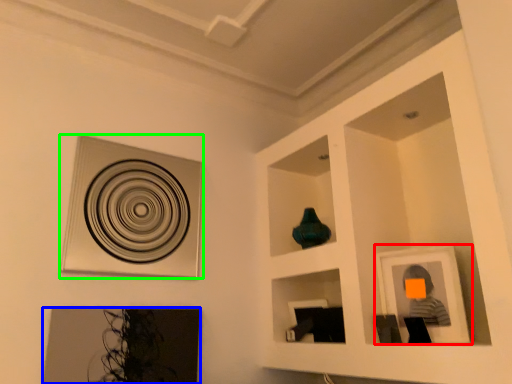
Question: Based on their relative distances, which object is nearer to picture frame (highlighted by a red box)? Choose from picture frame (highlighted by a blue box) and picture frame (highlighted by a green box).

Choices:
 (A) picture frame
 (B) picture frame

Answer: (A)